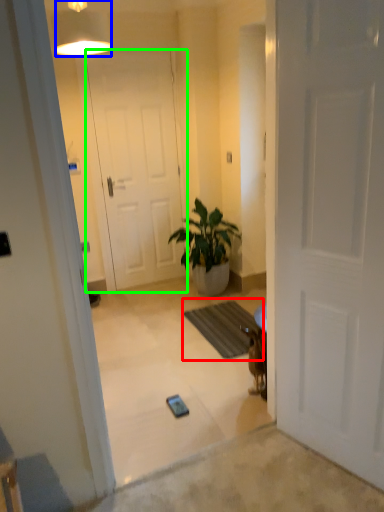
Question: Which is farther away from doormat (highlighted by a red box)? lamp (highlighted by a blue box) or door (highlighted by a green box)?

Choices:
 (A) lamp
 (B) door

Answer: (A)